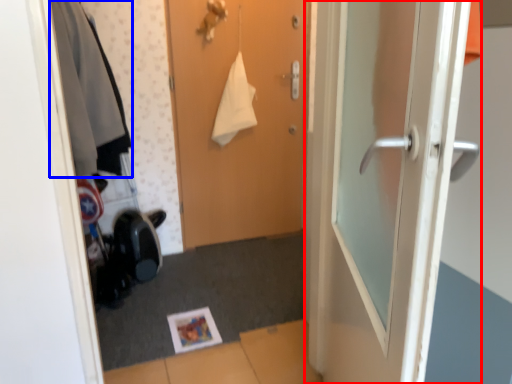
Question: Which object is further to the camera taking this photo, door (highlighted by a red box) or clothing (highlighted by a blue box)?

Choices:
 (A) door
 (B) clothing

Answer: (B)